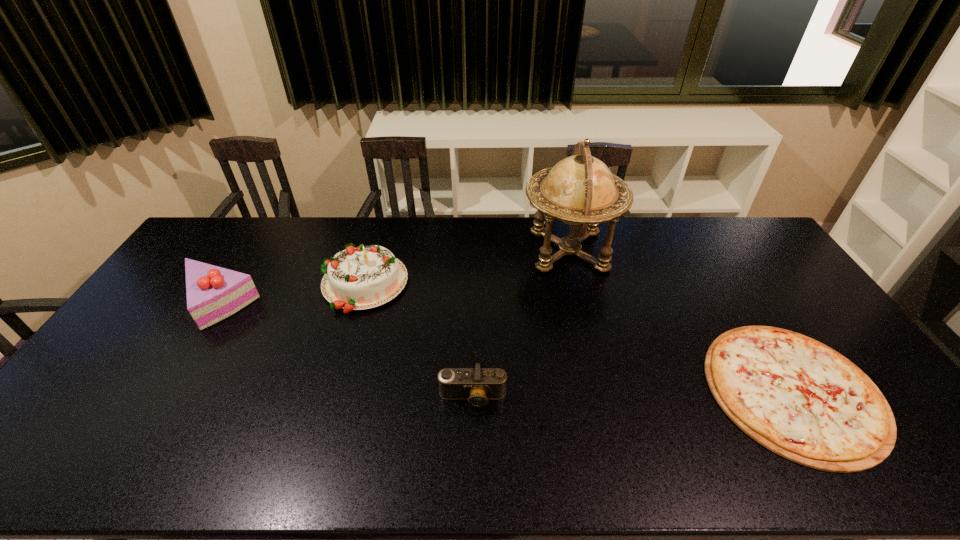
I want to click on the tallest object, so click(x=580, y=190).

Identify the location of the second object from right to left. This screenshot has width=960, height=540. (580, 190).

Find the location of `the right cake`. the right cake is located at coordinates (359, 278).

This screenshot has height=540, width=960. In order to click on the fourth shortest object in this screenshot , I will do `click(359, 278)`.

I want to click on the third shortest object, so click(x=213, y=293).

The height and width of the screenshot is (540, 960). I want to click on the leftmost object, so click(x=213, y=293).

The image size is (960, 540). In order to click on camera in this screenshot , I will do `click(477, 385)`.

This screenshot has width=960, height=540. I want to click on the second shortest object, so click(x=477, y=385).

I want to click on pizza, so click(797, 397).

Identify the location of the rightmost object. (797, 397).